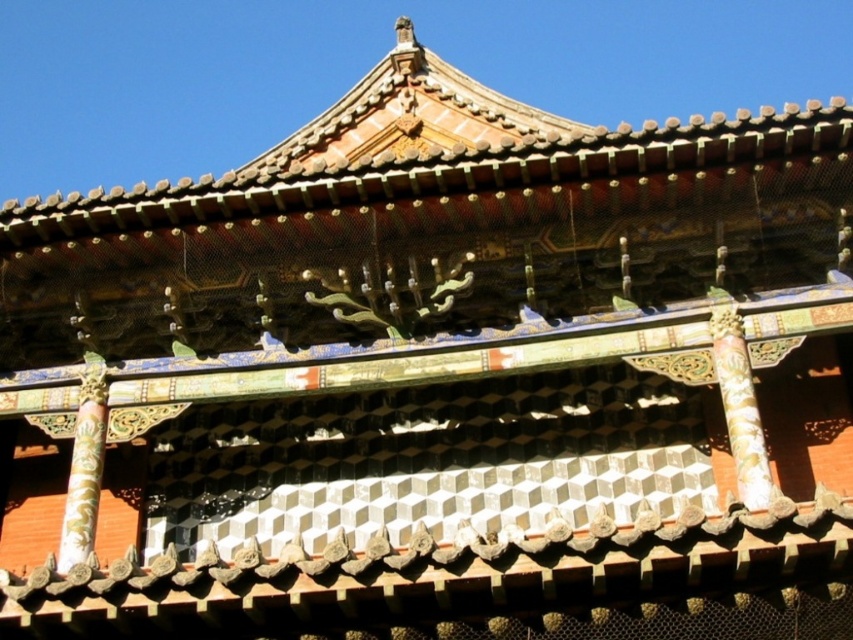
You are standing at point (740, 403) in the temple structure. What object is located exactly at your current position?

The gold carved wooden pillar at center is located exactly at point (740, 403).

You are standing in front of the East Asian architectural structure and notice two points marked on the image. The first point is at coordinates point (749, 472) and the second is at point (70, 467). Which point is nearer to your viewpoint?

Point (749, 472) is closer to the camera than point (70, 467), so the first point is nearer to your viewpoint.